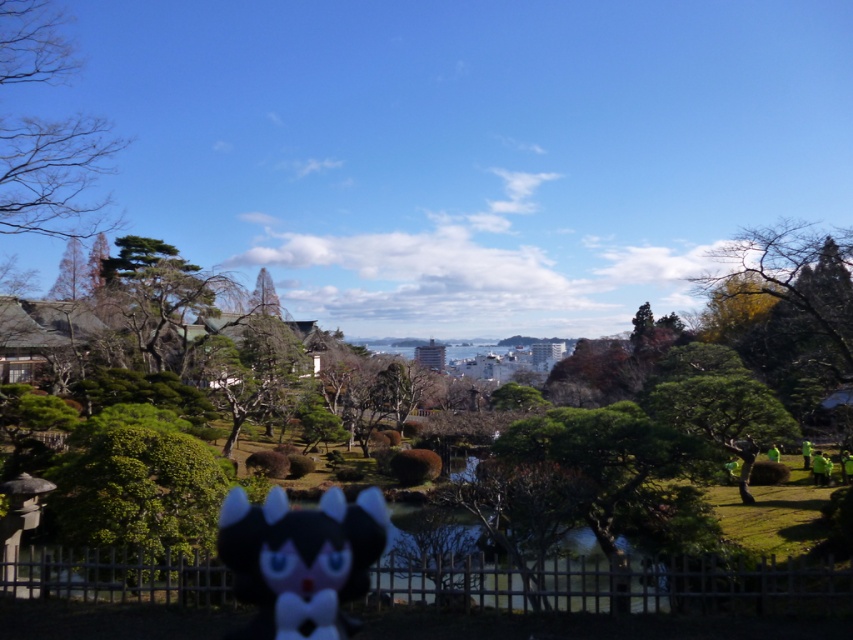
You are a photographer who wants to capture a photo of the black plush toy at center and the green leafy tree at right. Based on their sizes in the image, which one would appear bigger in the photo?

The green leafy tree at right appears bigger in the photo because it has a larger size compared to the black plush toy at center.